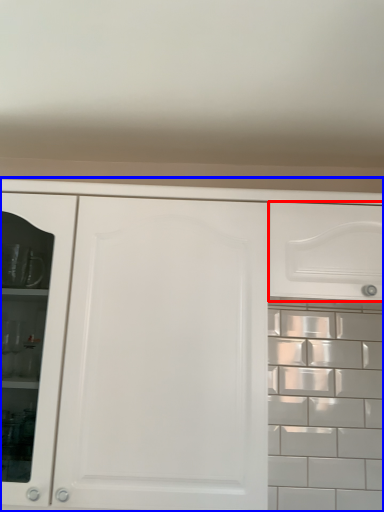
Question: Among these objects, which one is nearest to the camera, drawer (highlighted by a red box) or cabinetry (highlighted by a blue box)?

Choices:
 (A) drawer
 (B) cabinetry

Answer: (B)